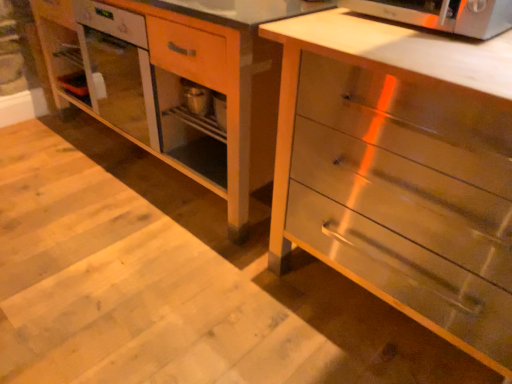
Locate an element on the screen. free point in front of wooden vanity at center is located at coordinates (139, 273).